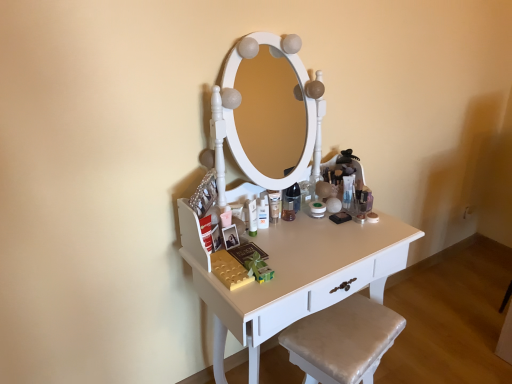
The image size is (512, 384). In order to click on vacant space that is in between matte white lotion at center, the second toiletry from the right, and translucent plastic tube at center, arranged as the second toiletry when viewed from the front in this screenshot , I will do `click(295, 225)`.